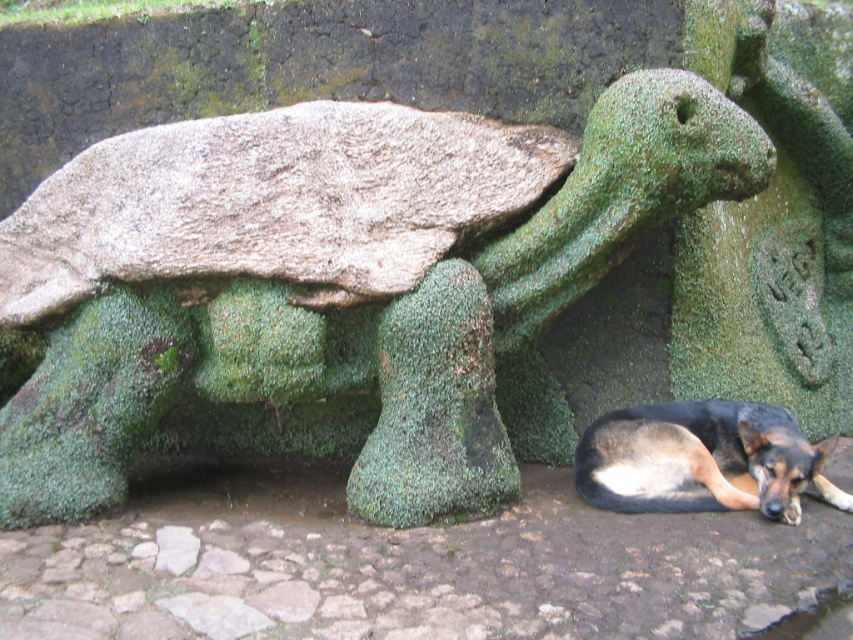
You are standing 10 feet away from a large stone turtle statue covered in moss. You want to take a closer look but need to ensure you can reach it without overextending. If you move forward 0.4 feet, will you be within 10 feet of the green mossy turtle at center?

The green mossy turtle at center is currently 9.60 feet away. If you move forward 0.4 feet, your distance to it becomes 9.60 minus 0.4 equals 9.20 feet, which is still within the 10 feet limit. Yes, you will be within 10 feet.

You are a photographer wanting to capture both the green mossy turtle at center and the black and tan fur dog at lower right in the same frame. Given their sizes, which one will appear larger in the photo?

The green mossy turtle at center will appear larger in the photo because it is much taller than the black and tan fur dog at lower right.

You are standing in front of the green mossy turtle at center and want to reach the black and tan fur dog at lower right. Which direction should you move to get closer to the dog?

The green mossy turtle at center is above the black and tan fur dog at lower right, so you should move downward to get closer to the dog.